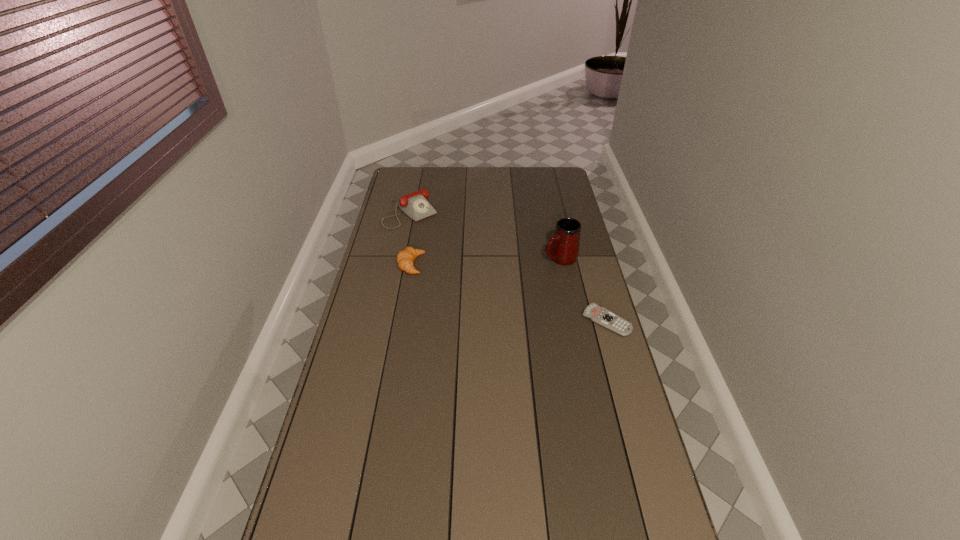
Where is `free space on the desktop that is between the second shortest object and the nearest object and is positioned on the side of the mug with the handle`? The height and width of the screenshot is (540, 960). free space on the desktop that is between the second shortest object and the nearest object and is positioned on the side of the mug with the handle is located at coordinates (487, 286).

Find the location of a particular element. free space on the desktop that is between the crescent roll and the nearest object and is positioned on the dial of the telephone is located at coordinates (492, 288).